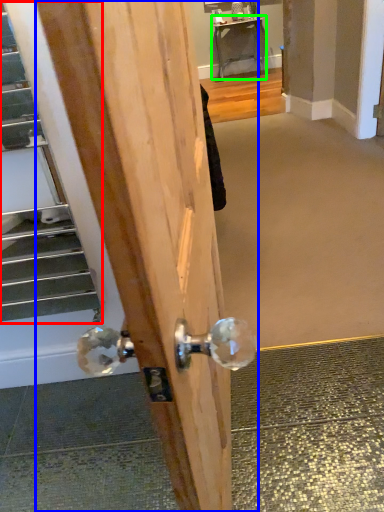
Question: Based on their relative distances, which object is farther from escalator (highlighted by a red box)? Choose from door (highlighted by a blue box) and table (highlighted by a green box).

Choices:
 (A) door
 (B) table

Answer: (B)